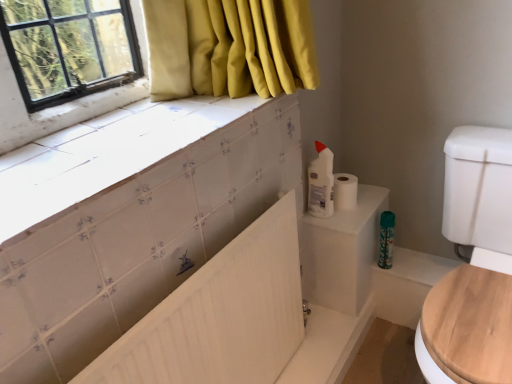
Find the location of a particular element. Image resolution: width=512 pixels, height=384 pixels. free space to the right of white matte toilet paper at upper right is located at coordinates (373, 196).